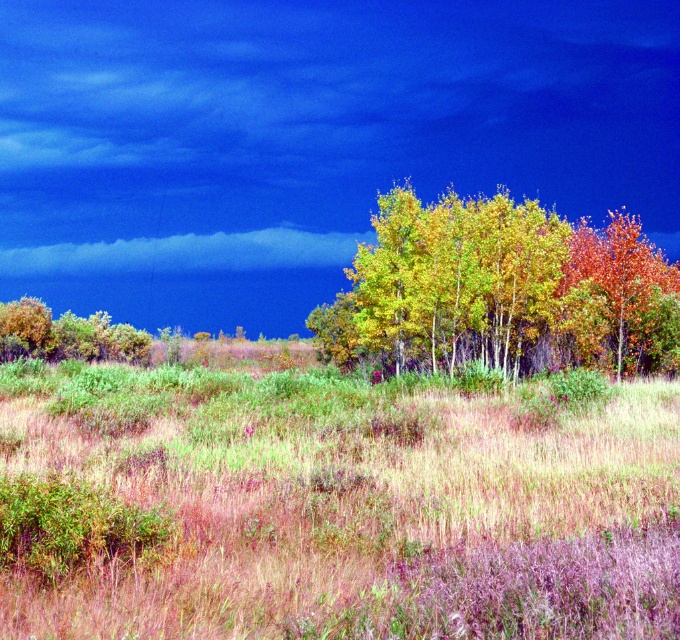
You are standing in the autumnal landscape and want to take a photo of the dry grass at center and the cloudy blue sky at upper center. Which object will appear larger in the photo?

The dry grass at center will appear larger in the photo because it is closer to the viewer than the cloudy blue sky at upper center.

In the scene shown: You are standing in the autumnal landscape and want to take a photo of the cloudy blue sky at upper center and the green leafy tree at left. Which object will appear closer to you in the photo?

The green leafy tree at left will appear closer to you in the photo because the cloudy blue sky at upper center is further away from the viewer.